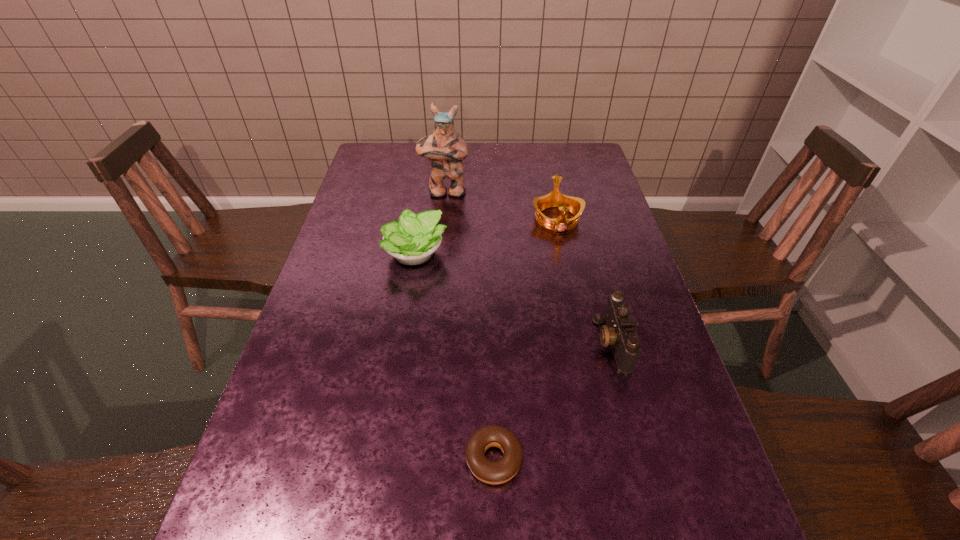
Locate an element on the screen. vacant space at the far right corner of the desktop is located at coordinates (593, 154).

The height and width of the screenshot is (540, 960). Identify the location of empty space between the tiara and the nearest object. (525, 339).

You are a GUI agent. You are given a task and a screenshot of the screen. Output one action in this format:
    pyautogui.click(x=<x>, y=<y>)
    Task: Click on the free spot between the third object from left to right and the lettuce
    
    Given the screenshot: What is the action you would take?
    pyautogui.click(x=455, y=357)

Locate an element on the screen. empty space that is in between the second nearest object and the tiara is located at coordinates (585, 280).

You are a GUI agent. You are given a task and a screenshot of the screen. Output one action in this format:
    pyautogui.click(x=<x>, y=<y>)
    Task: Click on the free space that is in between the fourth farthest object and the nearest object
    This screenshot has width=960, height=540.
    Given the screenshot: What is the action you would take?
    pyautogui.click(x=553, y=400)

Image resolution: width=960 pixels, height=540 pixels. I want to click on free spot between the lettuce and the camera, so click(514, 299).

The width and height of the screenshot is (960, 540). In order to click on free space between the camera and the third object from right to left in this screenshot , I will do `click(553, 400)`.

Locate an element on the screen. free area in between the nearest object and the farthest object is located at coordinates (469, 325).

Identify the location of blank region between the tallest object and the second nearest object. (529, 267).

Where is `the fourth closest object to the figurine`? The width and height of the screenshot is (960, 540). the fourth closest object to the figurine is located at coordinates (500, 471).